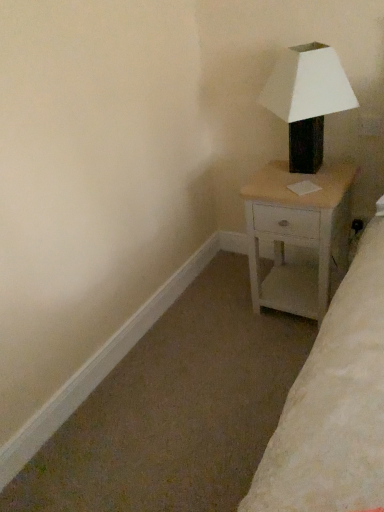
You are a GUI agent. You are given a task and a screenshot of the screen. Output one action in this format:
    pyautogui.click(x=<x>, y=<y>)
    Task: Click on the vacant space underneath matte black lamp at upper right (from a real-world perspective)
    
    Given the screenshot: What is the action you would take?
    pyautogui.click(x=307, y=176)